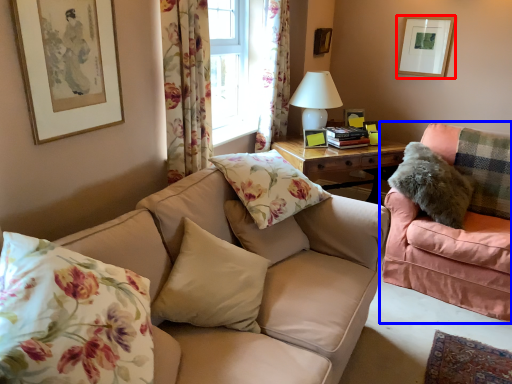
Question: Among these objects, which one is nearest to the camera, picture frame (highlighted by a red box) or studio couch (highlighted by a blue box)?

Choices:
 (A) picture frame
 (B) studio couch

Answer: (B)